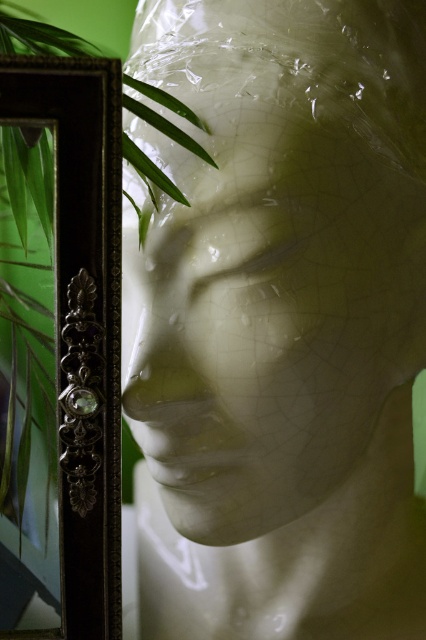
You are an artist trying to sketch the mannequin head and the frame. You notice two points marked on your reference image. Which of the two points, point (89, 218) or point (164, 104), is closer to you as you look at the scene?

Point (89, 218) is closer to the viewer than point (164, 104).

You are an interior designer arranging items on a shelf. You have a white matte sculpture at center and a green leafy plant at left. According to the scene, which item is positioned to the right of the other?

The white matte sculpture at center is to the right of the green leafy plant at left.

You are an interior designer arranging a living room. You have a white matte sculpture at center and a green leafy plant at left. Based on their sizes, which object should you place on a higher shelf to ensure both are visible?

The white matte sculpture at center is taller than the green leafy plant at left, so you should place the white matte sculpture at center on a lower shelf and the green leafy plant at left on a higher shelf to ensure both are visible.